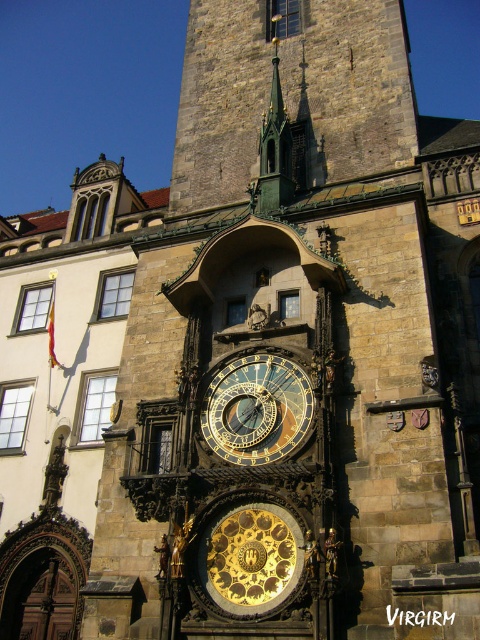
Does gold metallic clock at center have a greater height compared to gold plated clock at center?

Yes.

Describe the element at coordinates (256, 410) in the screenshot. This screenshot has width=480, height=640. I see `gold metallic clock at center` at that location.

Which is behind, point (276, 458) or point (266, 609)?

Point (276, 458)

Find the location of a particular element. This screenshot has width=480, height=640. gold metallic clock at center is located at coordinates (x=256, y=410).

Which is more to the right, gold plated clock at center or green metallic spire at upper center?

green metallic spire at upper center is more to the right.

Image resolution: width=480 pixels, height=640 pixels. I want to click on gold plated clock at center, so click(x=252, y=557).

Locate an element on the screen. gold plated clock at center is located at coordinates (252, 557).

Who is higher up, gold metallic clock at center or green metallic spire at upper center?

green metallic spire at upper center

At what (x,y) coordinates should I click in order to perform the action: click on gold metallic clock at center. Please return your answer as a coordinate pair (x, y). This screenshot has width=480, height=640. Looking at the image, I should click on (256, 410).

This screenshot has width=480, height=640. Describe the element at coordinates (256, 410) in the screenshot. I see `gold metallic clock at center` at that location.

This screenshot has width=480, height=640. What are the coordinates of `gold metallic clock at center` in the screenshot? It's located at (256, 410).